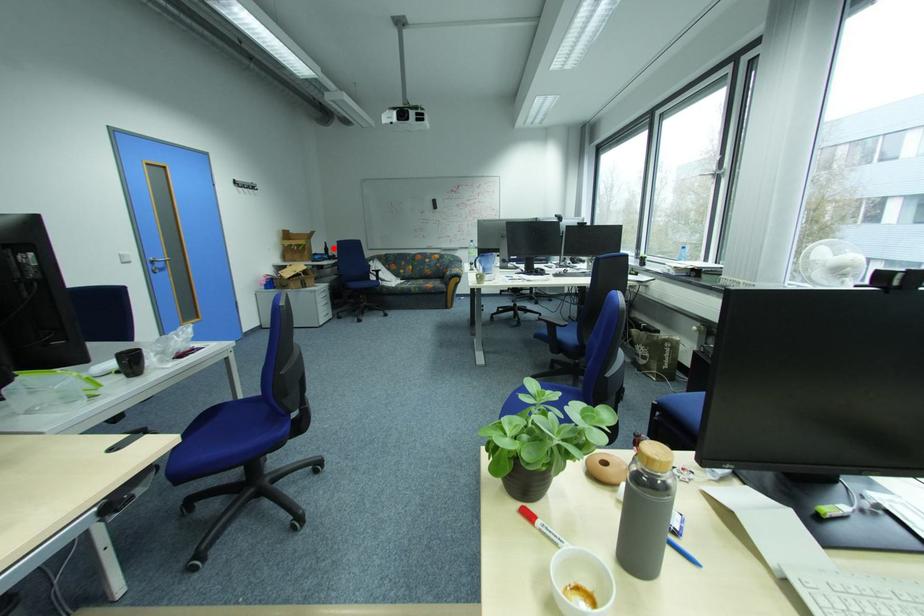
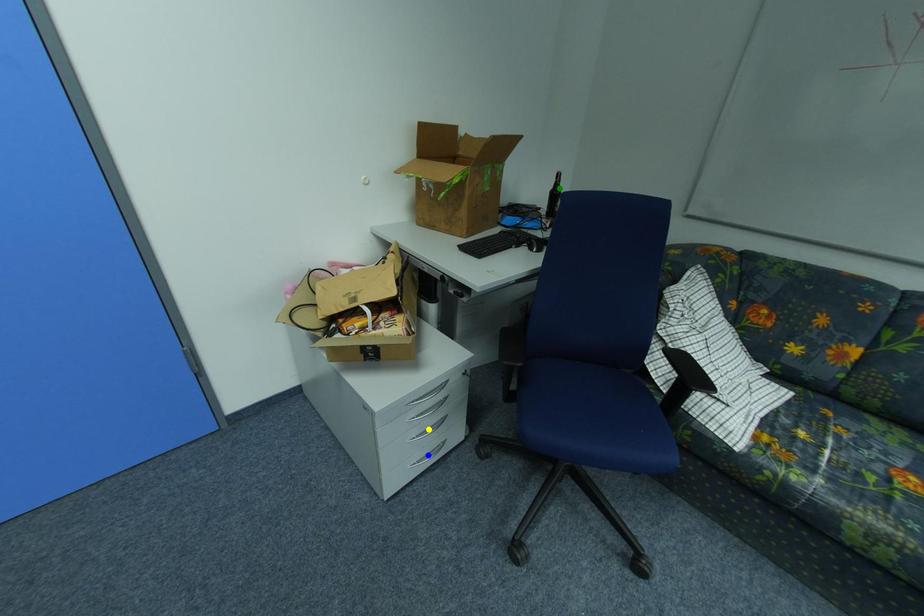
Question: I am providing you with two images of the same scene from different viewpoints. A red point is marked on the first image. You are given multiple points on the second image. Can you choose the point in image 2 that corresponds to the point in image 1?

Choices:
 (A) green point
 (B) yellow point
 (C) blue point

Answer: (A)